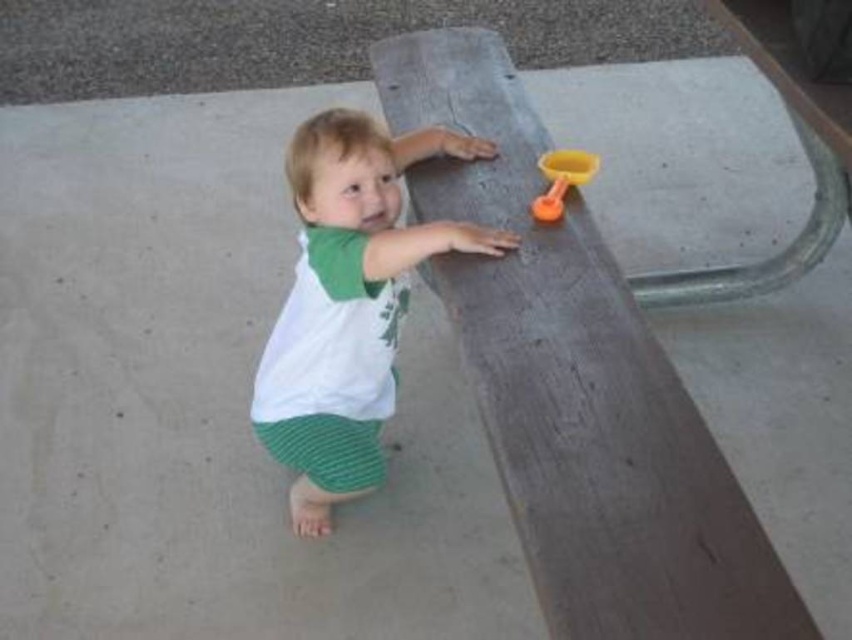
Question: Is white cotton shirt at center behind translucent orange spoon at upper right?

Choices:
 (A) yes
 (B) no

Answer: (B)

Question: Which point is farther to the camera?

Choices:
 (A) (550, 170)
 (B) (300, 454)

Answer: (A)

Question: Among these points, which one is farthest from the camera?

Choices:
 (A) (481, 385)
 (B) (547, 161)
 (C) (324, 301)

Answer: (B)

Question: Can you confirm if brown wood picnic table at center is bigger than translucent orange spoon at upper right?

Choices:
 (A) yes
 (B) no

Answer: (A)

Question: Among these points, which one is farthest from the camera?

Choices:
 (A) (281, 324)
 (B) (551, 161)

Answer: (B)

Question: Is brown wood picnic table at center bigger than translucent orange spoon at upper right?

Choices:
 (A) yes
 (B) no

Answer: (A)